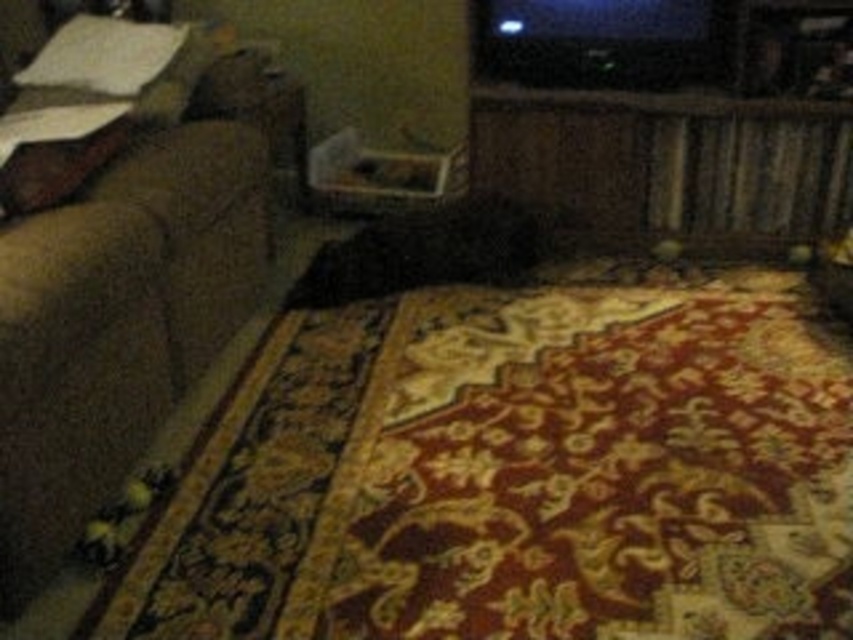
Question: Which object appears closest to the camera in this image?

Choices:
 (A) white soft pillow at upper left
 (B) suede-like brown couch at left

Answer: (B)

Question: Which object appears closest to the camera in this image?

Choices:
 (A) suede-like brown couch at left
 (B) white soft pillow at upper left

Answer: (A)

Question: Can you confirm if suede-like brown couch at left is positioned to the left of white soft pillow at upper left?

Choices:
 (A) no
 (B) yes

Answer: (A)

Question: Which object is closer to the camera taking this photo?

Choices:
 (A) white soft pillow at upper left
 (B) suede-like brown couch at left

Answer: (B)

Question: Does suede-like brown couch at left appear under white soft pillow at upper left?

Choices:
 (A) yes
 (B) no

Answer: (A)

Question: Can you confirm if suede-like brown couch at left is positioned above white soft pillow at upper left?

Choices:
 (A) yes
 (B) no

Answer: (B)